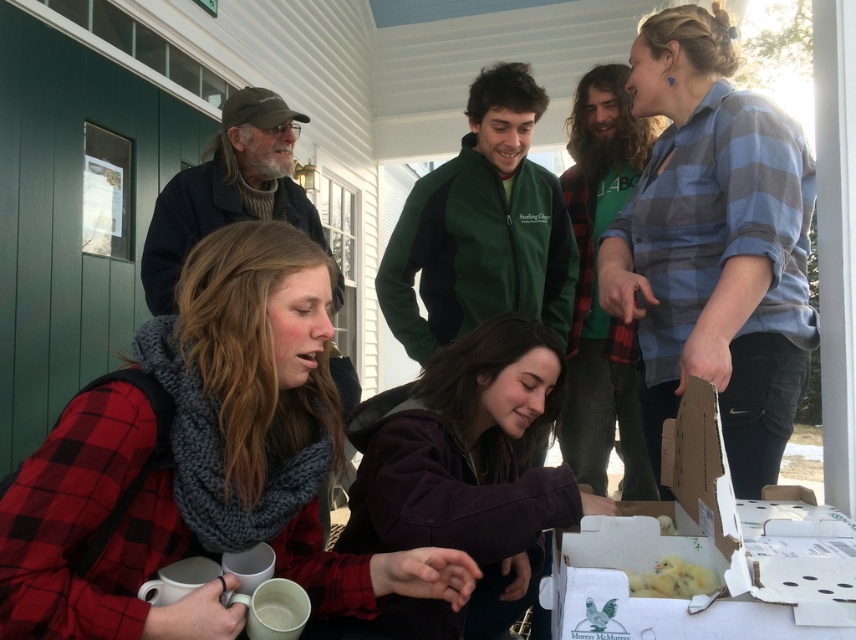
Can you confirm if purple soft fabric at center is bigger than yellow fluffy chicks at lower center?

Yes, purple soft fabric at center is bigger than yellow fluffy chicks at lower center.

The image size is (856, 640). What do you see at coordinates (464, 476) in the screenshot?
I see `purple soft fabric at center` at bounding box center [464, 476].

Image resolution: width=856 pixels, height=640 pixels. I want to click on purple soft fabric at center, so click(464, 476).

I want to click on purple soft fabric at center, so click(x=464, y=476).

This screenshot has width=856, height=640. What do you see at coordinates (204, 461) in the screenshot? I see `red plaid shirt at lower left` at bounding box center [204, 461].

Which of these two, red plaid shirt at lower left or purple soft fabric at center, stands shorter?

red plaid shirt at lower left

Locate an element on the screen. The image size is (856, 640). red plaid shirt at lower left is located at coordinates (204, 461).

Identify the location of red plaid shirt at lower left. (204, 461).

Is point (535, 403) closer to camera compared to point (794, 502)?

No, it is not.

How distant is purple soft fabric at center from white cardboard box at lower right?

The distance of purple soft fabric at center from white cardboard box at lower right is 13.62 inches.

I want to click on purple soft fabric at center, so click(x=464, y=476).

Find the location of a particular element. The height and width of the screenshot is (640, 856). purple soft fabric at center is located at coordinates (464, 476).